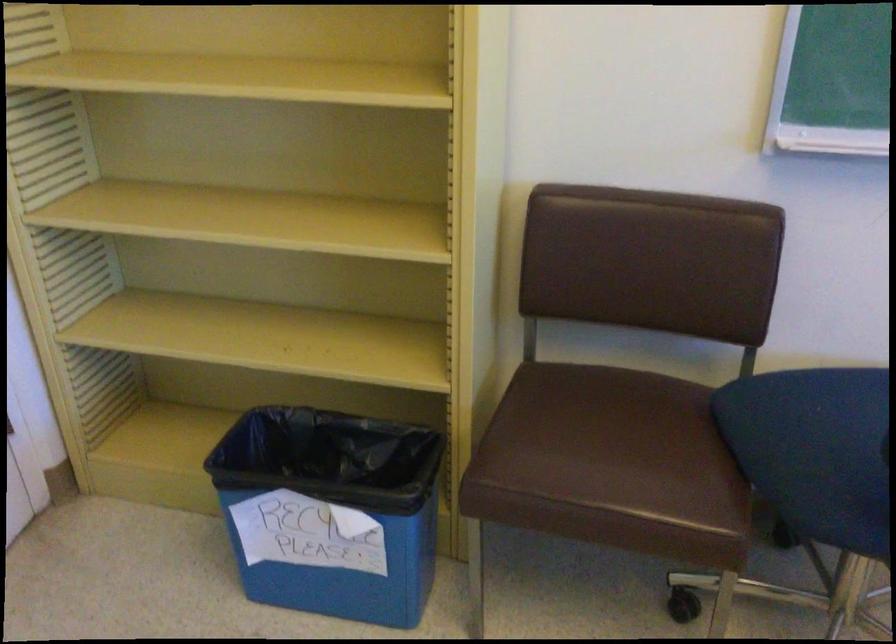
Find where to lift the blue recycling bin. Please return your answer as a coordinate pair (x, y).

(331, 511)